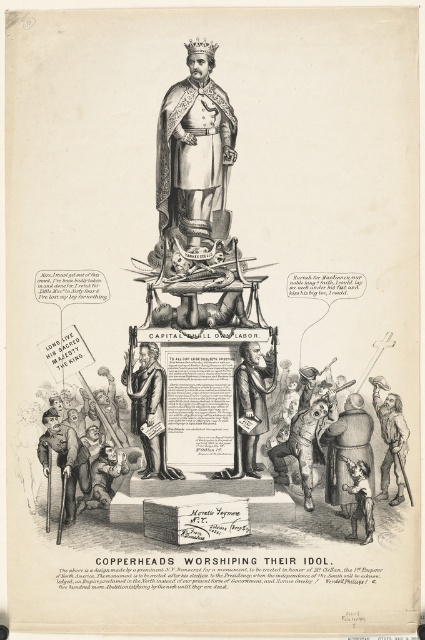
Which is in front, point (229, 113) or point (147, 353)?

Point (147, 353) is more forward.

Is point (198, 147) positioned behind point (132, 388)?

Yes, it is behind point (132, 388).

The width and height of the screenshot is (425, 640). Find the location of `gold textured crown at center`. gold textured crown at center is located at coordinates (193, 150).

In the scene shown: Can you confirm if gold plated statue at center is positioned below bronze statue at center?

Incorrect, gold plated statue at center is not positioned below bronze statue at center.

Is gold plated statue at center to the right of bronze statue at center from the viewer's perspective?

Yes, gold plated statue at center is to the right of bronze statue at center.

Does point (198, 248) come behind point (130, 390)?

Yes, it is.

This screenshot has width=425, height=640. What are the coordinates of `gold plated statue at center` in the screenshot? It's located at (197, 204).

The height and width of the screenshot is (640, 425). What are the coordinates of `bronze statue at center` in the screenshot? It's located at (149, 408).

Does bronze statue at center have a greater width compared to matte black cane at lower left?

Yes.

Between point (146, 417) and point (68, 516), which one is positioned in front?

Point (146, 417) is more forward.

This screenshot has height=640, width=425. Identify the location of bronze statue at center. (149, 408).